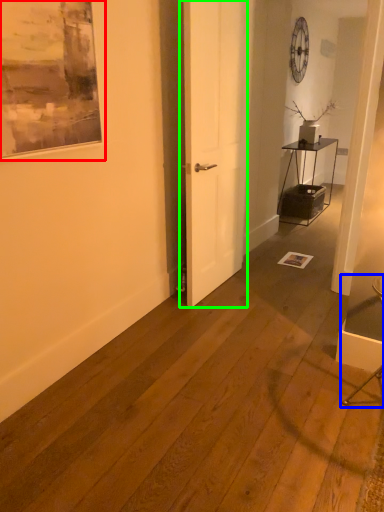
Question: Which object is the farthest from picture frame (highlighted by a red box)? Choose among these: armchair (highlighted by a blue box) or door (highlighted by a green box).

Choices:
 (A) armchair
 (B) door

Answer: (A)